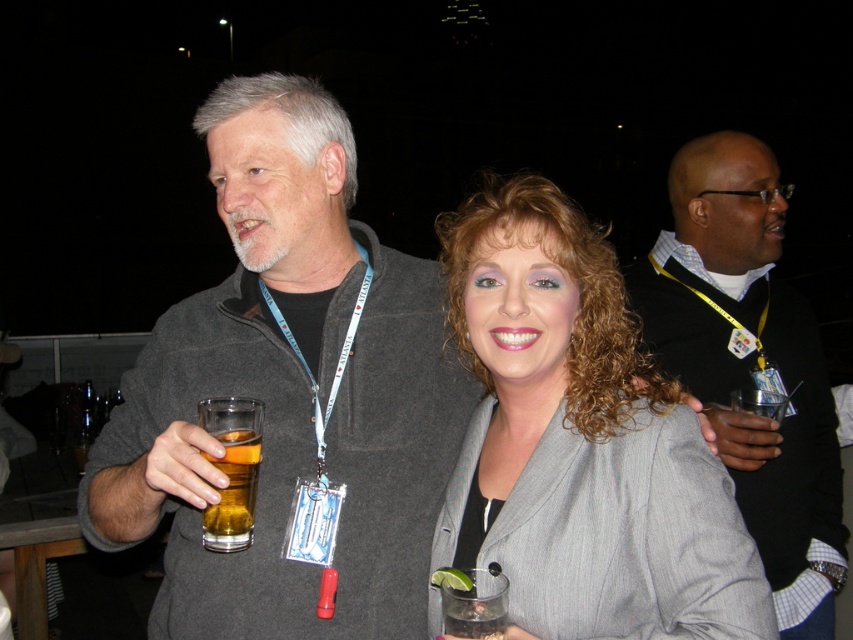
Does black sweater at upper right appear on the left side of translucent glass beer at center?

No, black sweater at upper right is not to the left of translucent glass beer at center.

Which is more to the right, black sweater at upper right or translucent glass beer at center?

black sweater at upper right is more to the right.

Describe the element at coordinates (750, 364) in the screenshot. The image size is (853, 640). I see `black sweater at upper right` at that location.

Where is `black sweater at upper right`? This screenshot has width=853, height=640. black sweater at upper right is located at coordinates [x=750, y=364].

How distant is gray fabric jacket at center from translucent glass beer at center?

The distance of gray fabric jacket at center from translucent glass beer at center is 17.28 inches.

Is point (534, 614) more distant than point (230, 499)?

No, (534, 614) is closer to viewer.

This screenshot has height=640, width=853. What are the coordinates of `gray fabric jacket at center` in the screenshot? It's located at (581, 442).

The height and width of the screenshot is (640, 853). Find the location of `gray fabric jacket at center`. gray fabric jacket at center is located at coordinates (581, 442).

From the picture: Which is more to the left, gray fabric jacket at center or black sweater at upper right?

From the viewer's perspective, gray fabric jacket at center appears more on the left side.

Does gray fabric jacket at center have a greater width compared to black sweater at upper right?

In fact, gray fabric jacket at center might be narrower than black sweater at upper right.

What are the coordinates of `gray fabric jacket at center` in the screenshot? It's located at (581, 442).